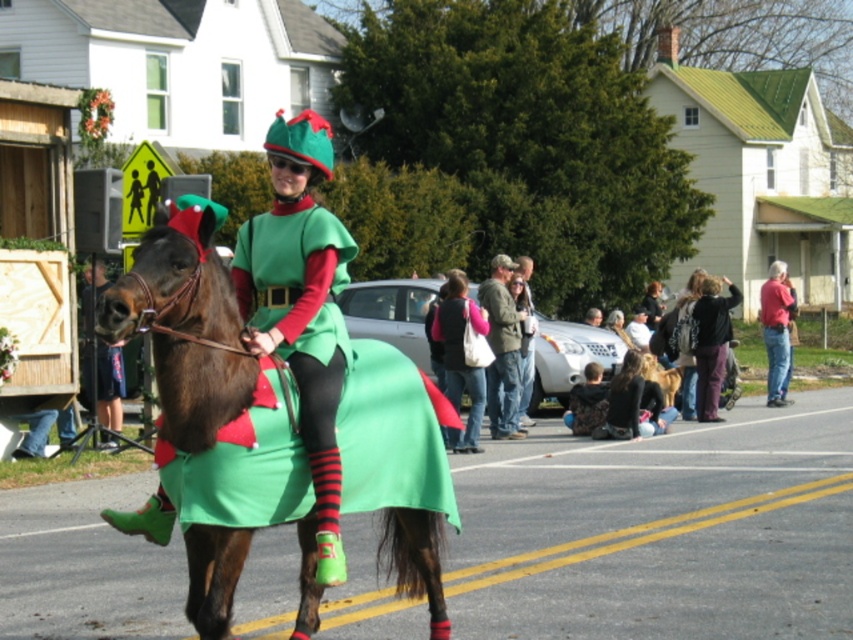
You are a photographer trying to capture the green matte dress at center in the image. What are the coordinates where you should focus your camera?

The green matte dress at center is located at coordinates point [300,321].

You are a photographer at the event trying to capture both the camouflage jacket at center and the red shirt at right in a single shot. Which clothing item should you focus on first to ensure both are in frame?

Since the camouflage jacket at center is smaller in size compared to the red shirt at right, you should focus on the camouflage jacket at center first to ensure both fit within the frame.